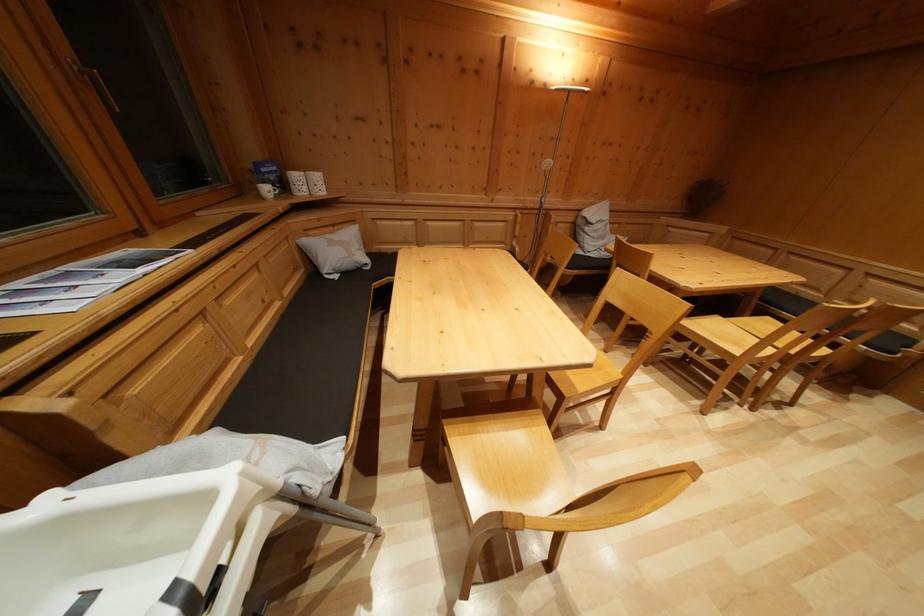
Identify the location of white highchair seat. This screenshot has width=924, height=616. pyautogui.click(x=139, y=545).